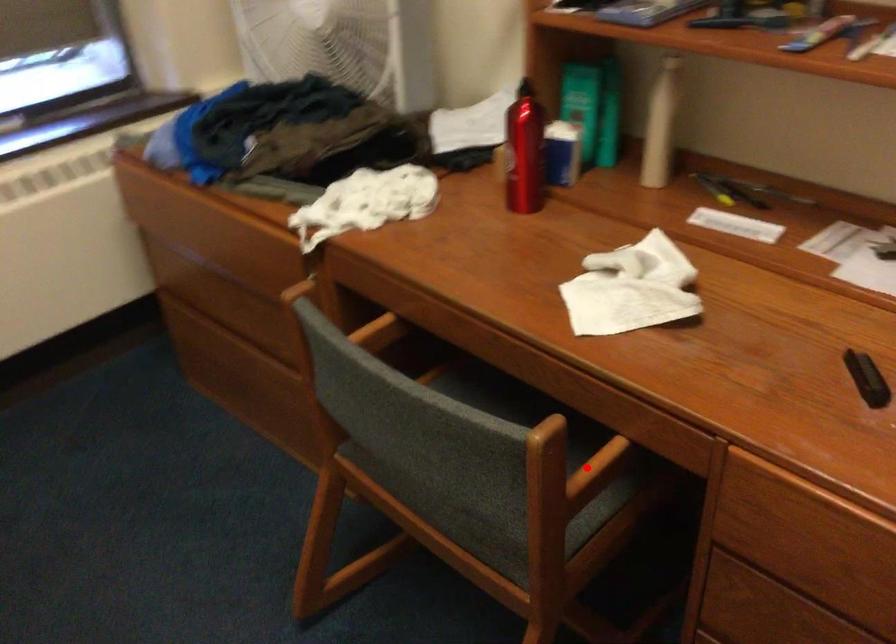
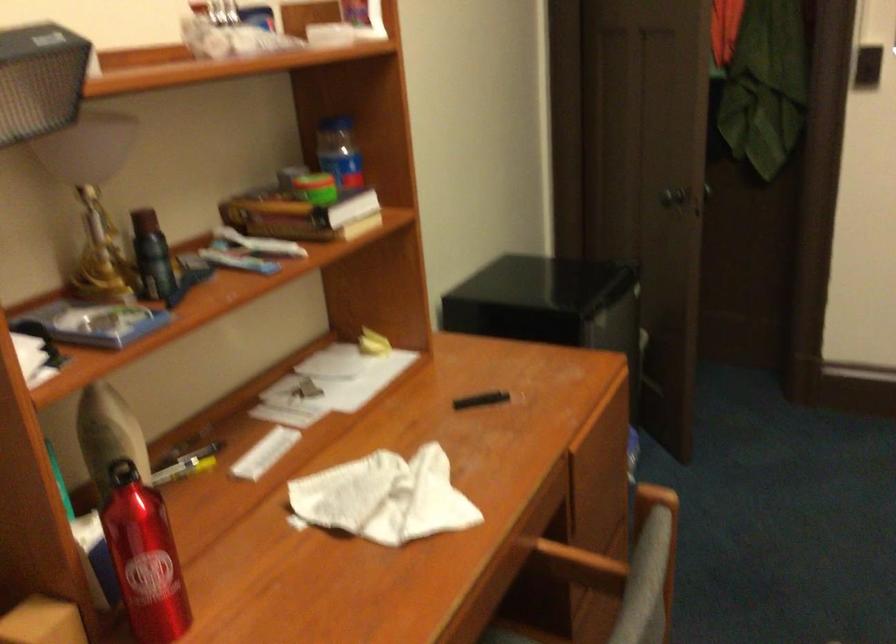
The point at the highlighted location is marked in the first image. Where is the corresponding point in the second image?

(579, 565)